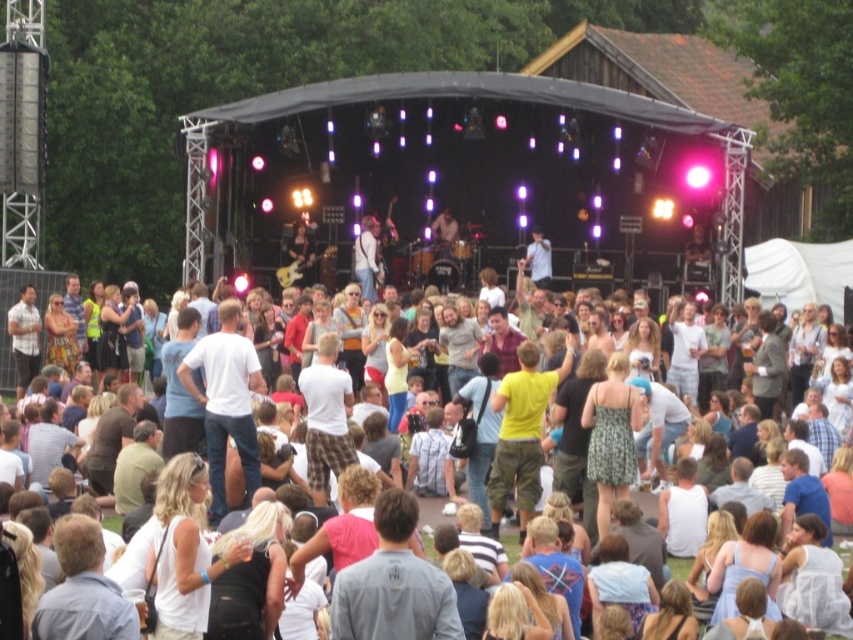
Does white cotton shirt at center have a lesser width compared to light brown leather guitar at center?

In fact, white cotton shirt at center might be wider than light brown leather guitar at center.

Which is behind, point (218, 451) or point (450, 250)?

The point (450, 250) is behind.

The width and height of the screenshot is (853, 640). I want to click on white cotton shirt at center, so click(x=225, y=401).

This screenshot has height=640, width=853. What are the coordinates of `light brown leather jacket at center` in the screenshot? It's located at (367, 259).

Who is taller, light brown leather jacket at center or light brown leather guitar at center?

light brown leather jacket at center is taller.

Does point (367, 240) come in front of point (450, 243)?

Yes, point (367, 240) is closer to viewer.

I want to click on light brown leather jacket at center, so click(367, 259).

Can you confirm if white cotton shirt at center is positioned to the left of light blue cotton shirt at center?

Correct, you'll find white cotton shirt at center to the left of light blue cotton shirt at center.

Who is positioned more to the right, white cotton shirt at center or light blue cotton shirt at center?

light blue cotton shirt at center

Who is more distant from viewer, (254, 442) or (833, 636)?

Positioned behind is point (254, 442).

In order to click on white cotton shirt at center in this screenshot , I will do `click(225, 401)`.